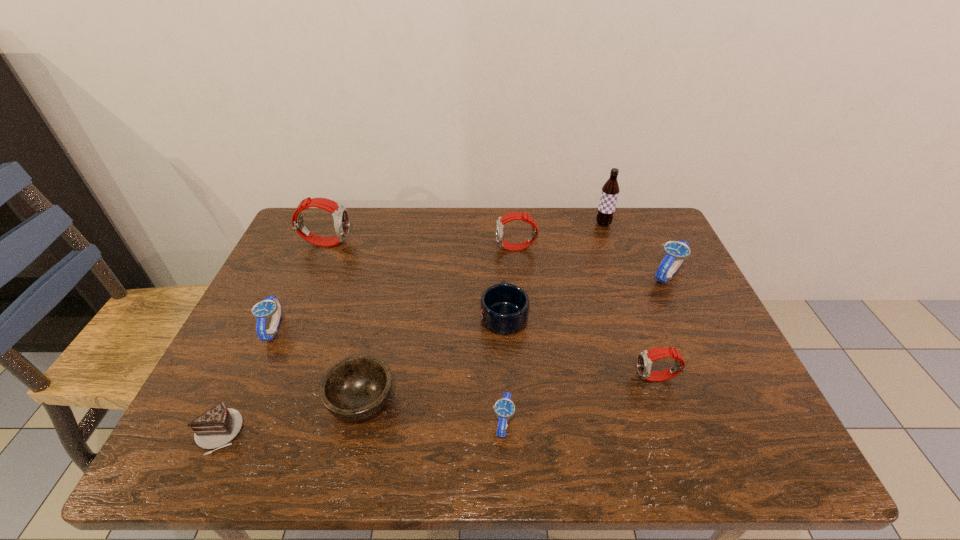
Locate an element on the screen. Image resolution: width=960 pixels, height=540 pixels. the tallest object is located at coordinates (610, 190).

This screenshot has height=540, width=960. In order to click on root beer in this screenshot , I will do `click(610, 190)`.

The image size is (960, 540). Find the location of `the ninth shortest object`. the ninth shortest object is located at coordinates (340, 215).

The height and width of the screenshot is (540, 960). I want to click on the tallest watch, so click(340, 215).

Locate an element on the screen. The height and width of the screenshot is (540, 960). the second tallest watch is located at coordinates (502, 220).

Where is `the second smallest red watch`? The width and height of the screenshot is (960, 540). the second smallest red watch is located at coordinates (502, 220).

At what (x,y) coordinates should I click in order to perform the action: click on the rightmost object. Please return your answer as a coordinate pair (x, y). The height and width of the screenshot is (540, 960). Looking at the image, I should click on (675, 252).

Where is `the fourth nearest watch`? the fourth nearest watch is located at coordinates (675, 252).

The image size is (960, 540). Find the location of `the fifth watch from left to right`. the fifth watch from left to right is located at coordinates (645, 358).

Find the location of a particular element. The image size is (960, 540). the fifth farthest watch is located at coordinates (645, 358).